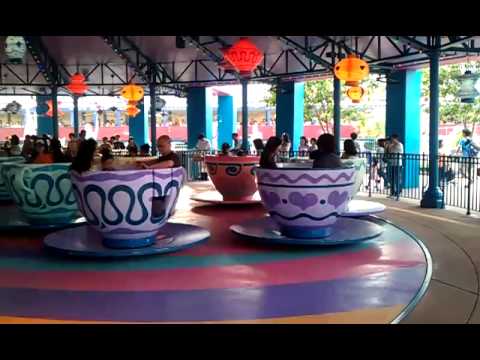
Where is `red hanging decorative ball`? The height and width of the screenshot is (360, 480). red hanging decorative ball is located at coordinates (243, 47), (79, 84).